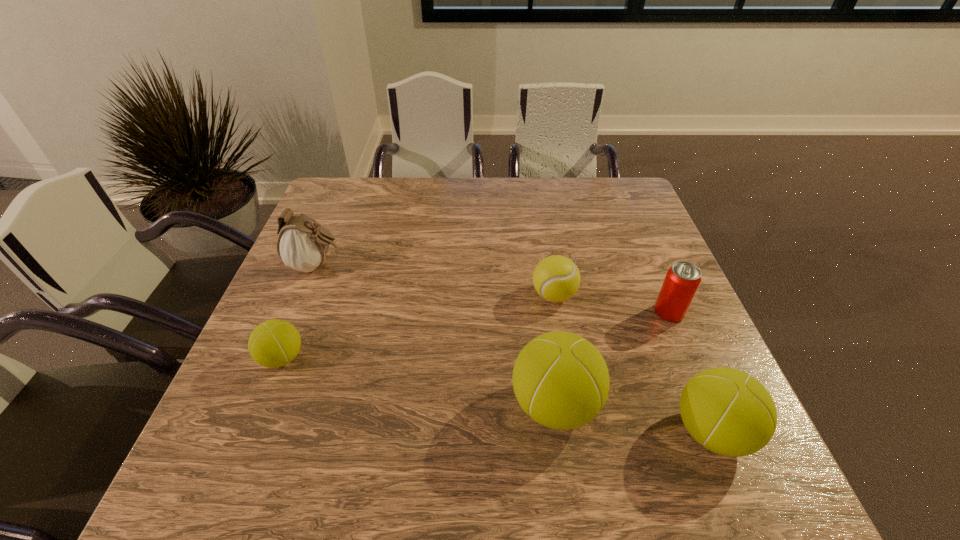
At what (x,y) coordinates should I click in order to perform the action: click on free region at the far right corner of the desktop. Please return your answer as a coordinate pair (x, y). The width and height of the screenshot is (960, 540). Looking at the image, I should click on (620, 201).

Locate an element on the screen. Image resolution: width=960 pixels, height=540 pixels. empty location between the farthest tennis ball and the pouch is located at coordinates (435, 281).

The height and width of the screenshot is (540, 960). Identify the location of vacant area between the leftmost tennis ball and the pouch. (300, 312).

I want to click on vacant point located between the pouch and the can, so click(x=492, y=289).

This screenshot has width=960, height=540. What are the coordinates of `free space between the pouch and the farthest tennis ball` in the screenshot? It's located at (435, 281).

What are the coordinates of `object that stands as the second closest to the pouch` in the screenshot? It's located at (556, 278).

Where is `object that is the fourth closest to the farthest tennis ball`? object that is the fourth closest to the farthest tennis ball is located at coordinates (302, 245).

Find the location of `tennis ball that is the third nearest to the rightmost tennis ball`. tennis ball that is the third nearest to the rightmost tennis ball is located at coordinates (274, 343).

The height and width of the screenshot is (540, 960). Identify the location of tennis ball that stands as the second closest to the can. (731, 413).

Find the location of a particular element. vacant space that satisfies the following two spatial constraints: 1. on the back side of the can; 2. on the front-facing side of the pouch is located at coordinates (650, 266).